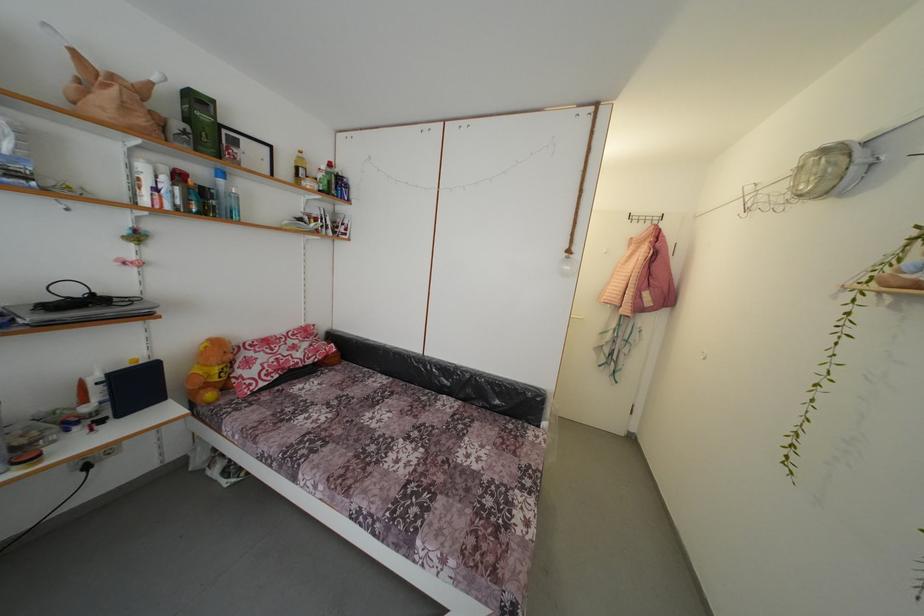
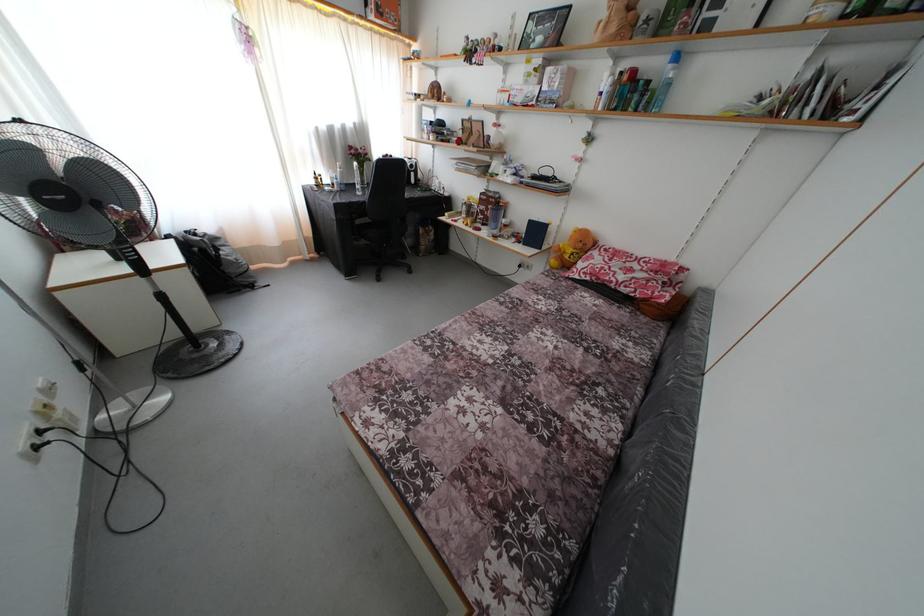
Where in the second image is the point corresponding to pixel 225 187 from the first image?

(675, 73)